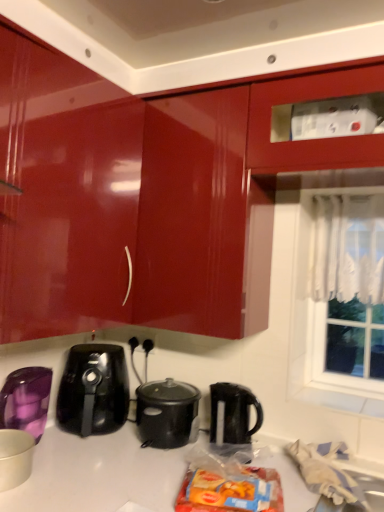
Question: From a real-world perspective, does black plastic kettle at center sit lower than white lace curtain at upper right?

Choices:
 (A) yes
 (B) no

Answer: (A)

Question: Is there a large distance between black plastic kettle at center and white lace curtain at upper right?

Choices:
 (A) yes
 (B) no

Answer: (B)

Question: Is black plastic kettle at center placed right next to white lace curtain at upper right?

Choices:
 (A) yes
 (B) no

Answer: (B)

Question: Is the depth of black plastic kettle at center greater than that of white lace curtain at upper right?

Choices:
 (A) no
 (B) yes

Answer: (A)

Question: From the image's perspective, would you say black plastic kettle at center is shown under white lace curtain at upper right?

Choices:
 (A) yes
 (B) no

Answer: (A)

Question: Is black glossy air fryer at lower center inside or outside of white lace curtain at right?

Choices:
 (A) inside
 (B) outside

Answer: (B)

Question: Based on their positions, is black glossy air fryer at lower center located to the left or right of white lace curtain at right?

Choices:
 (A) left
 (B) right

Answer: (A)

Question: Is black glossy air fryer at lower center in front of or behind white lace curtain at right in the image?

Choices:
 (A) behind
 (B) front

Answer: (B)

Question: Looking at their shapes, would you say black glossy air fryer at lower center is wider or thinner than white lace curtain at right?

Choices:
 (A) wide
 (B) thin

Answer: (A)

Question: Considering the positions of white lace curtain at upper right and matte white bowl at lower left, positioned as the second kitchen appliance in back-to-front order, in the image, is white lace curtain at upper right bigger or smaller than matte white bowl at lower left, positioned as the second kitchen appliance in back-to-front order,?

Choices:
 (A) big
 (B) small

Answer: (A)

Question: Is white lace curtain at upper right inside the boundaries of matte white bowl at lower left, positioned as the 1th kitchen appliance in front-to-back order, or outside?

Choices:
 (A) outside
 (B) inside

Answer: (A)

Question: Considering their positions, is white lace curtain at upper right located in front of or behind matte white bowl at lower left, positioned as the second kitchen appliance in back-to-front order?

Choices:
 (A) behind
 (B) front

Answer: (A)

Question: From the image's perspective, relative to matte white bowl at lower left, positioned as the second kitchen appliance in back-to-front order, is white lace curtain at upper right above or below?

Choices:
 (A) below
 (B) above

Answer: (B)

Question: Is black plastic kettle at center to the left or to the right of matte white bowl at lower left, positioned as the 1th kitchen appliance in front-to-back order, in the image?

Choices:
 (A) left
 (B) right

Answer: (B)

Question: Based on their sizes in the image, would you say black plastic kettle at center is bigger or smaller than matte white bowl at lower left, positioned as the second kitchen appliance in back-to-front order?

Choices:
 (A) small
 (B) big

Answer: (B)